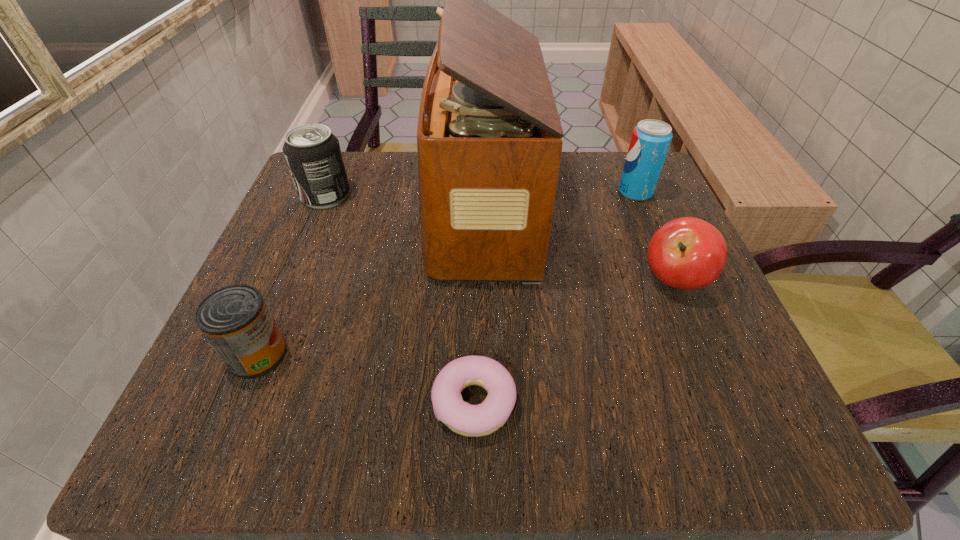
Locate an element on the screen. blank space located 0.100m on the right of the left soda can is located at coordinates (399, 195).

The image size is (960, 540). I want to click on free space located on the front of the apple, so click(x=740, y=433).

Locate an element on the screen. The height and width of the screenshot is (540, 960). vacant space located on the right of the can is located at coordinates (348, 354).

Find the location of a particular element. Image resolution: width=960 pixels, height=540 pixels. vacant space situated 0.070m on the back of the shortest object is located at coordinates (474, 328).

The height and width of the screenshot is (540, 960). In order to click on radio receiver that is at the far edge in this screenshot , I will do `click(489, 144)`.

At what (x,y) coordinates should I click in order to perform the action: click on object that is at the near edge. Please return your answer as a coordinate pair (x, y). The height and width of the screenshot is (540, 960). Looking at the image, I should click on (465, 419).

I want to click on soda can that is at the left edge, so click(313, 155).

Locate an element on the screen. can at the left edge is located at coordinates (235, 319).

This screenshot has width=960, height=540. I want to click on soda can that is at the right edge, so click(650, 141).

The image size is (960, 540). What are the coordinates of `apple that is at the right edge` in the screenshot? It's located at (687, 253).